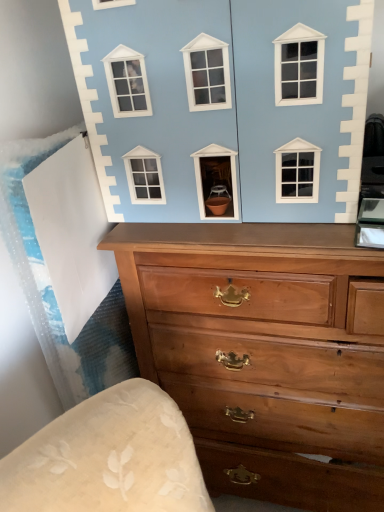
Image resolution: width=384 pixels, height=512 pixels. Describe the element at coordinates (265, 352) in the screenshot. I see `wooden chest of drawers at center` at that location.

Locate an element on the screen. This screenshot has width=384, height=512. wooden chest of drawers at center is located at coordinates point(265,352).

You are a GUI agent. You are given a task and a screenshot of the screen. Output one action in this format:
    pyautogui.click(x=<x>, y=<y>)
    Task: Click on the wooden chest of drawers at center
    
    Given the screenshot: What is the action you would take?
    pyautogui.click(x=265, y=352)